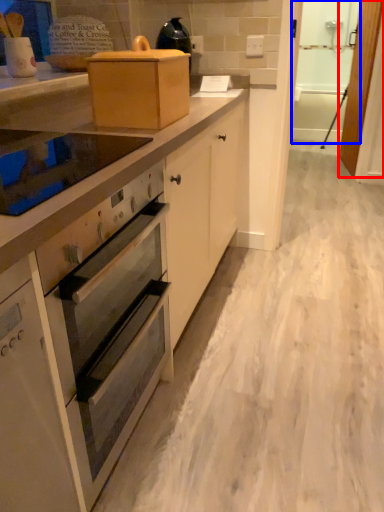
Question: Which object is further to the camera taking this photo, screen door (highlighted by a red box) or screen door (highlighted by a blue box)?

Choices:
 (A) screen door
 (B) screen door

Answer: (A)